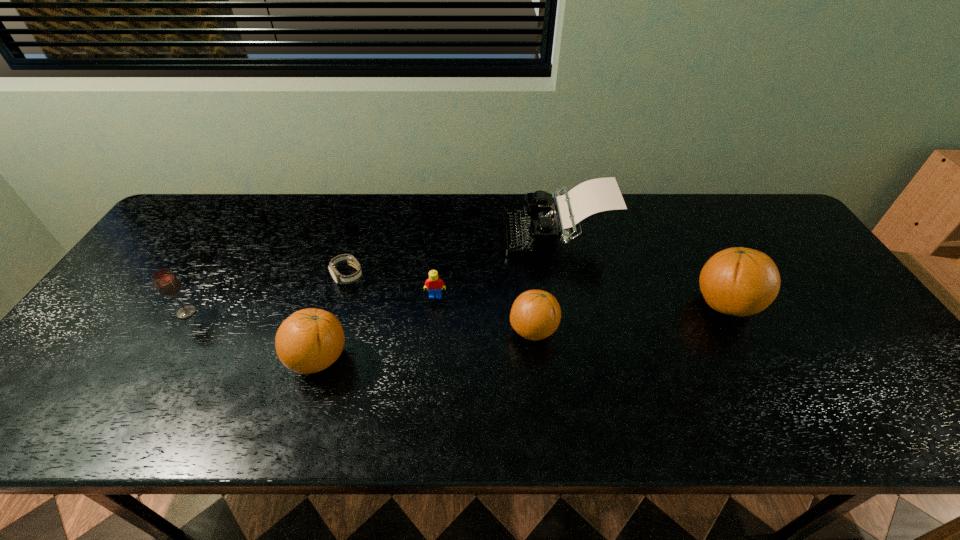
Find the location of a particular element. This screenshot has width=960, height=540. vacant spot to place a orange on the left is located at coordinates (77, 392).